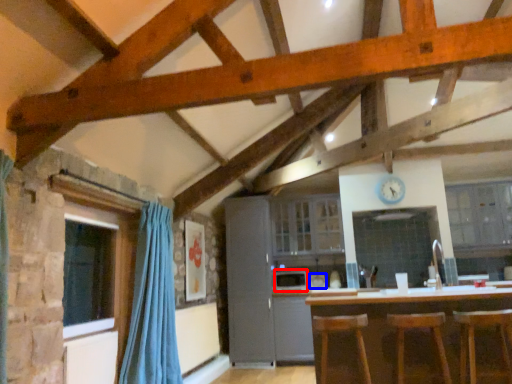
Question: Which object appears farthest to the camera in this image, appliance (highlighted by a red box) or appliance (highlighted by a blue box)?

Choices:
 (A) appliance
 (B) appliance

Answer: (B)